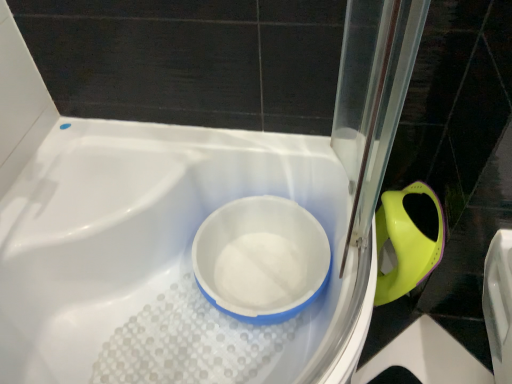
Question: Is white plastic bath at center positioned in front of matte green plastic bidet at right?

Choices:
 (A) no
 (B) yes

Answer: (B)

Question: Is white plastic bath at center taller than matte green plastic bidet at right?

Choices:
 (A) yes
 (B) no

Answer: (A)

Question: Can you confirm if white plastic bath at center is shorter than matte green plastic bidet at right?

Choices:
 (A) yes
 (B) no

Answer: (B)

Question: Does white plastic bath at center appear on the left side of matte green plastic bidet at right?

Choices:
 (A) no
 (B) yes

Answer: (B)

Question: From the image's perspective, is white plastic bath at center on top of matte green plastic bidet at right?

Choices:
 (A) yes
 (B) no

Answer: (B)

Question: In the image, is white plastic bowl at center positioned in front of or behind white plastic bath at center?

Choices:
 (A) behind
 (B) front

Answer: (A)

Question: Considering the positions of white plastic bowl at center and white plastic bath at center in the image, is white plastic bowl at center wider or thinner than white plastic bath at center?

Choices:
 (A) thin
 (B) wide

Answer: (A)

Question: Is white plastic bowl at center inside the boundaries of white plastic bath at center, or outside?

Choices:
 (A) inside
 (B) outside

Answer: (A)

Question: In terms of height, does white plastic bowl at center look taller or shorter compared to white plastic bath at center?

Choices:
 (A) tall
 (B) short

Answer: (B)

Question: In the image, is white plastic bowl at center on the left side or the right side of matte green plastic bidet at right?

Choices:
 (A) right
 (B) left

Answer: (B)

Question: From the image's perspective, relative to matte green plastic bidet at right, is white plastic bowl at center above or below?

Choices:
 (A) below
 (B) above

Answer: (A)

Question: From a real-world perspective, is white plastic bowl at center positioned above or below matte green plastic bidet at right?

Choices:
 (A) below
 (B) above

Answer: (B)

Question: Considering their positions, is white plastic bowl at center located in front of or behind matte green plastic bidet at right?

Choices:
 (A) behind
 (B) front

Answer: (B)

Question: Looking at their shapes, would you say white plastic bath at center is wider or thinner than matte green plastic bidet at right?

Choices:
 (A) wide
 (B) thin

Answer: (A)

Question: Considering the positions of white plastic bath at center and matte green plastic bidet at right in the image, is white plastic bath at center taller or shorter than matte green plastic bidet at right?

Choices:
 (A) short
 (B) tall

Answer: (B)